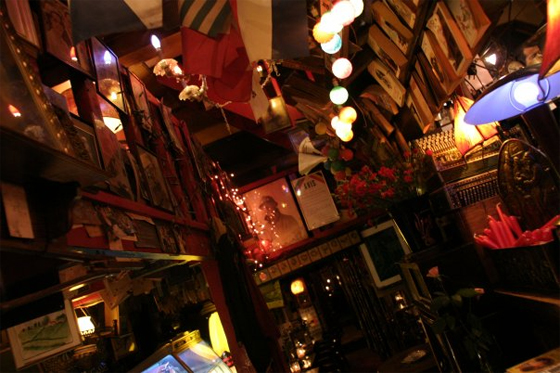
The width and height of the screenshot is (560, 373). What are the coordinates of `lamp shade` in the screenshot? It's located at (492, 100).